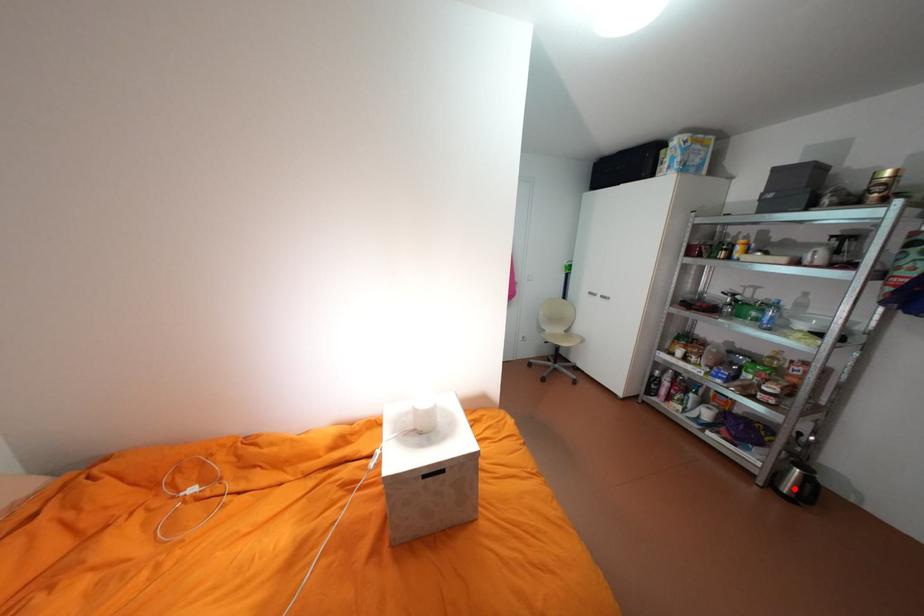
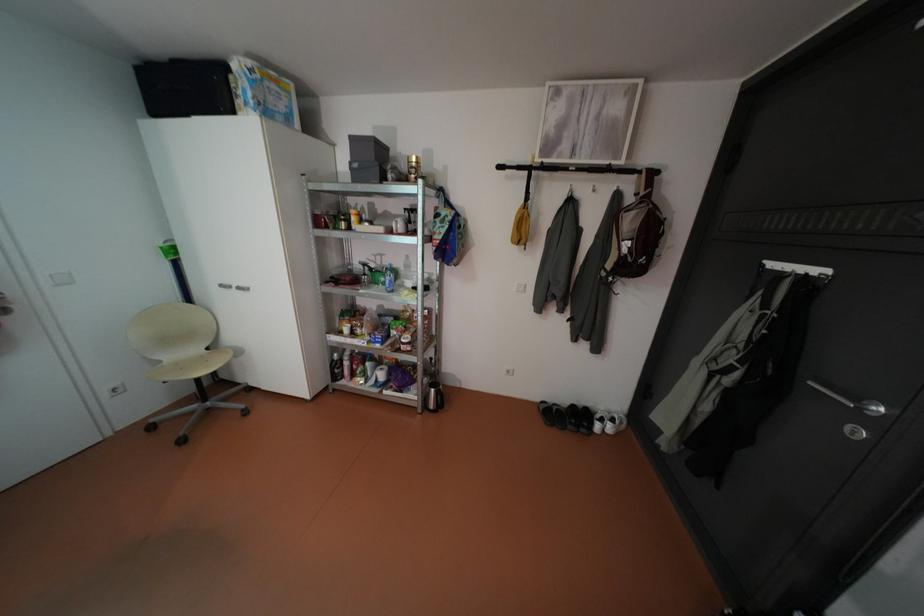
Locate, in the second image, the point that corresponds to the highlighted location in the first image.

(441, 405)